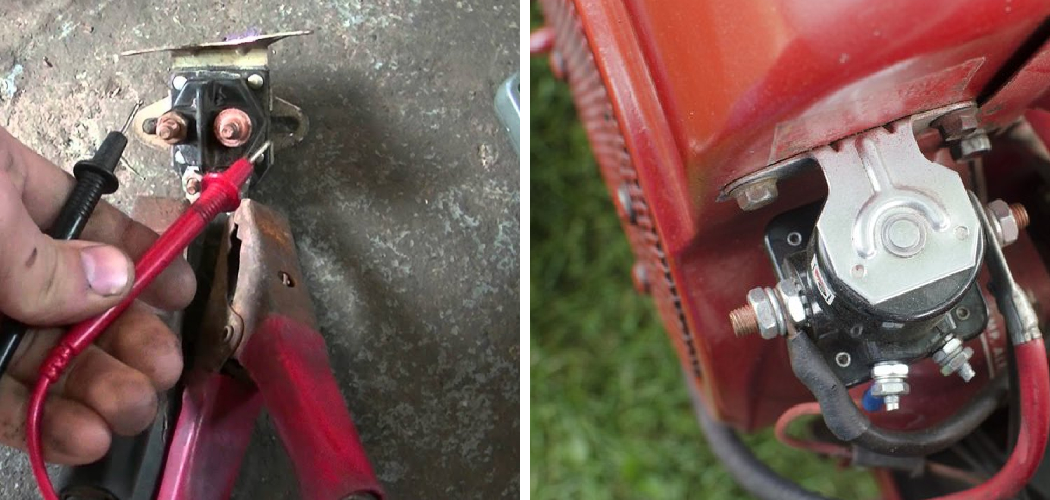
Image resolution: width=1050 pixels, height=500 pixels. What are the coordinates of `black cord` in the screenshot? It's located at (953, 424), (69, 205), (5, 340).